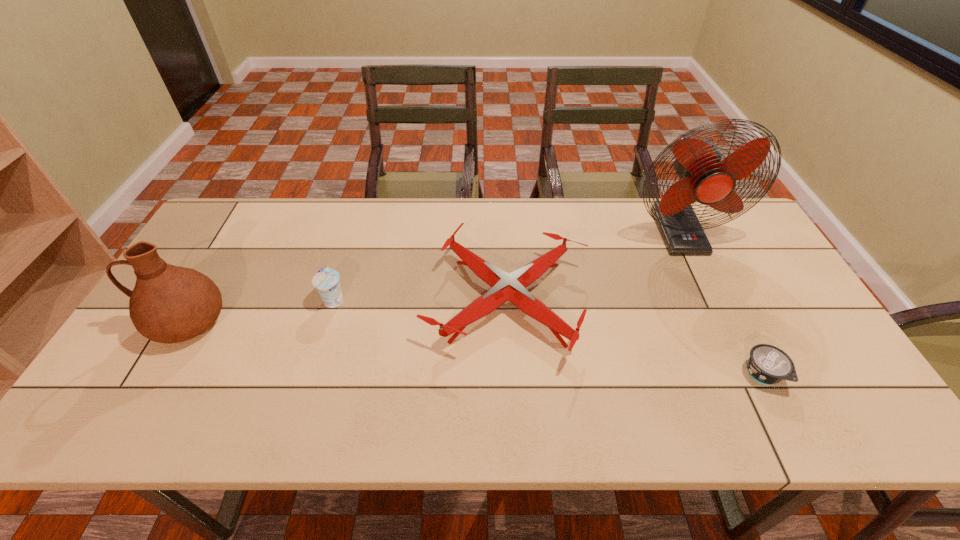
Find the location of a particular element. This screenshot has width=960, height=540. vacant space situated 0.300m on the left of the left yogurt is located at coordinates (212, 300).

Locate an element on the screen. Image resolution: width=960 pixels, height=540 pixels. vacant area situated 0.280m on the back of the shorter yogurt is located at coordinates (712, 275).

Where is `fan that is at the far edge`? fan that is at the far edge is located at coordinates (703, 177).

Where is `drone present at the far edge`? drone present at the far edge is located at coordinates (511, 287).

Where is `object positioned at the left edge`? object positioned at the left edge is located at coordinates (169, 304).

What are the coordinates of `fan that is at the right edge` in the screenshot? It's located at (703, 177).

Find the location of `yogurt present at the right edge`. yogurt present at the right edge is located at coordinates (767, 364).

Identify the location of object located in the far right corner section of the desktop. Image resolution: width=960 pixels, height=540 pixels. (703, 177).

Locate an element on the screen. Image resolution: width=960 pixels, height=540 pixels. free space at the far edge of the desktop is located at coordinates (447, 213).

Find the location of a particular element. vacant space at the near edge of the desktop is located at coordinates (571, 435).